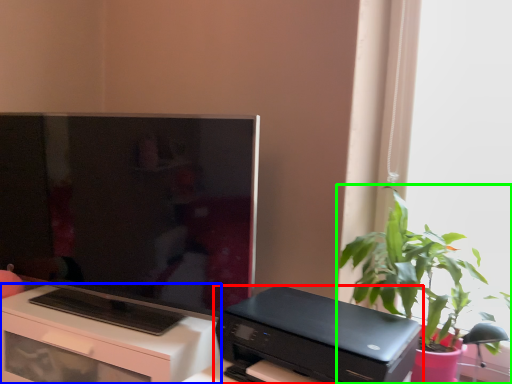
Question: Which object is the closest to the printer (highlighted by a red box)? Choose among these: desk (highlighted by a blue box) or houseplant (highlighted by a green box).

Choices:
 (A) desk
 (B) houseplant

Answer: (B)